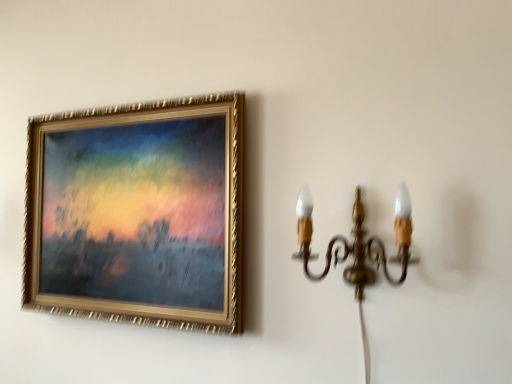
Find the location of a particular element. Image resolution: width=512 pixels, height=384 pixels. gold brass wall sconce at right is located at coordinates (358, 249).

This screenshot has height=384, width=512. What do you see at coordinates (358, 249) in the screenshot? I see `gold brass wall sconce at right` at bounding box center [358, 249].

What do you see at coordinates (138, 213) in the screenshot?
I see `gold-framed painting at upper left` at bounding box center [138, 213].

Measure the distance between point (181,161) and camera.

The distance of point (181,161) from camera is 1.21 meters.

Where is `gold-framed painting at upper left`? The image size is (512, 384). gold-framed painting at upper left is located at coordinates (138, 213).

This screenshot has height=384, width=512. I want to click on gold brass wall sconce at right, so click(358, 249).

Is gold brass wall sconce at right at the right side of gold-framed painting at upper left?

Indeed, gold brass wall sconce at right is positioned on the right side of gold-framed painting at upper left.

Is the depth of gold brass wall sconce at right less than that of gold-framed painting at upper left?

Yes, gold brass wall sconce at right is closer to the camera.

Is point (396, 197) closer to camera compared to point (101, 294)?

Yes.

From the image's perspective, is gold brass wall sconce at right below gold-framed painting at upper left?

Yes, from the image's perspective, gold brass wall sconce at right is below gold-framed painting at upper left.

In the scene shown: From a real-world perspective, is gold brass wall sconce at right over gold-framed painting at upper left?

No, from a real-world perspective, gold brass wall sconce at right is not above gold-framed painting at upper left.

Is gold brass wall sconce at right wider or thinner than gold-framed painting at upper left?

gold brass wall sconce at right is wider than gold-framed painting at upper left.

Between gold brass wall sconce at right and gold-framed painting at upper left, which one has less height?

Standing shorter between the two is gold brass wall sconce at right.

Is gold brass wall sconce at right bigger than gold-framed painting at upper left?

Actually, gold brass wall sconce at right might be smaller than gold-framed painting at upper left.

Which is correct: gold brass wall sconce at right is inside gold-framed painting at upper left, or outside of it?

gold brass wall sconce at right is outside gold-framed painting at upper left.

Based on the photo, is gold brass wall sconce at right next to gold-framed painting at upper left?

gold brass wall sconce at right is not next to gold-framed painting at upper left, and they're not touching.

Is gold-framed painting at upper left at the back of gold brass wall sconce at right?

That's not correct — gold brass wall sconce at right is not looking away from gold-framed painting at upper left.

How different are the orientations of gold brass wall sconce at right and gold-framed painting at upper left in degrees?

There is a 0.436-degree angle between the facing directions of gold brass wall sconce at right and gold-framed painting at upper left.

At what (x,y) coordinates should I click in order to perform the action: click on picture frame on the left of gold brass wall sconce at right. Please return your answer as a coordinate pair (x, y). This screenshot has height=384, width=512. Looking at the image, I should click on (138, 213).

Considering the positions of objects gold-framed painting at upper left and gold brass wall sconce at right in the image provided, who is more to the right, gold-framed painting at upper left or gold brass wall sconce at right?

Positioned to the right is gold brass wall sconce at right.

Considering the positions of objects gold-framed painting at upper left and gold brass wall sconce at right in the image provided, who is behind, gold-framed painting at upper left or gold brass wall sconce at right?

gold-framed painting at upper left is further from the camera.

Which is less distant, (123,281) or (362,354)?

The point (362,354) is closer to the camera.

From the image's perspective, would you say gold-framed painting at upper left is shown under gold brass wall sconce at right?

No, from the image's perspective, gold-framed painting at upper left is not below gold brass wall sconce at right.

From a real-world perspective, is gold-framed painting at upper left on gold brass wall sconce at right?

Indeed, from a real-world perspective, gold-framed painting at upper left stands above gold brass wall sconce at right.

Considering the relative sizes of gold-framed painting at upper left and gold brass wall sconce at right in the image provided, is gold-framed painting at upper left wider than gold brass wall sconce at right?

No.

Consider the image. Which of these two, gold-framed painting at upper left or gold brass wall sconce at right, stands shorter?

gold brass wall sconce at right is shorter.

Looking at the image, does gold-framed painting at upper left seem bigger or smaller compared to gold brass wall sconce at right?

In the image, gold-framed painting at upper left appears to be larger than gold brass wall sconce at right.

In the scene shown: Would you say gold-framed painting at upper left is inside or outside gold brass wall sconce at right?

gold-framed painting at upper left lies outside gold brass wall sconce at right.

Is gold-framed painting at upper left not close to gold brass wall sconce at right?

They are positioned close to each other.

Is gold-framed painting at upper left positioned with its back to gold brass wall sconce at right?

gold-framed painting at upper left does not have its back to gold brass wall sconce at right.

How far apart are gold-framed painting at upper left and gold brass wall sconce at right?

gold-framed painting at upper left is 18.96 inches away from gold brass wall sconce at right.

Identify the location of picture frame above the gold brass wall sconce at right (from a real-world perspective). Image resolution: width=512 pixels, height=384 pixels. (138, 213).

In order to click on picture frame that is above the gold brass wall sconce at right (from the image's perspective) in this screenshot , I will do (138, 213).

You are a GUI agent. You are given a task and a screenshot of the screen. Output one action in this format:
    pyautogui.click(x=<x>, y=<y>)
    Task: Click on the lamp on the right of gold-framed painting at upper left
    
    Given the screenshot: What is the action you would take?
    pyautogui.click(x=358, y=249)